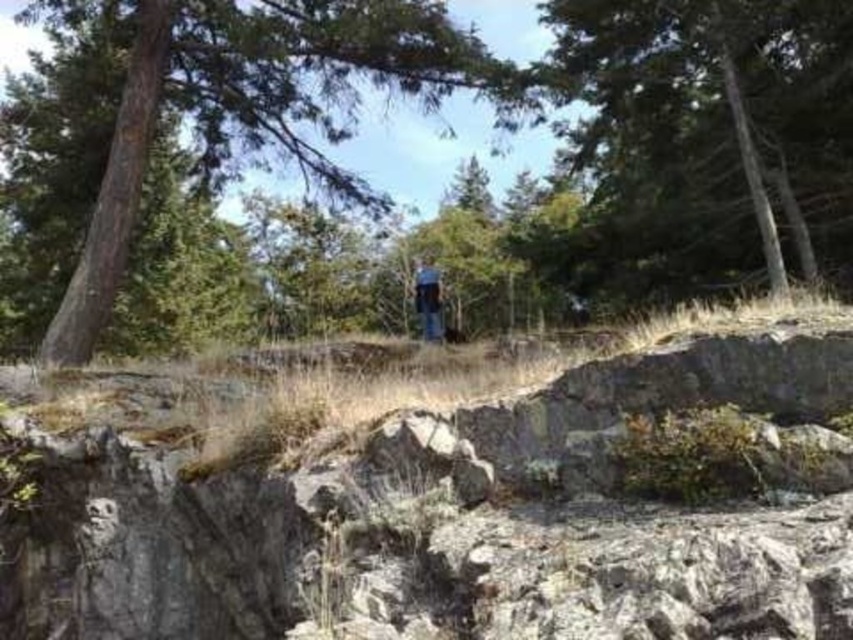
You are a photographer trying to capture a landscape photo. You have two points marked in the scene, point A at coordinates point (x=334, y=65) and point B at coordinates point (x=433, y=284). Which point is closer to your camera lens?

Point point (x=334, y=65) is closer to the camera lens than point point (x=433, y=284).

You are a hiker who wants to take a photo of the blue jeans at center and the green textured tree at upper center. Which object should you focus on first if you want to capture both in the same frame without moving your camera?

The blue jeans at center is closer to you than the green textured tree at upper center, so you should focus on the blue jeans at center first to ensure both are in focus.